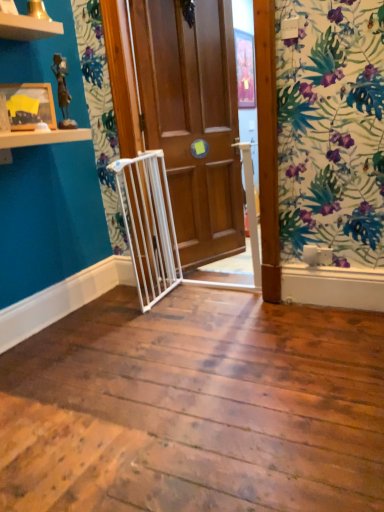
Question: Considering the positions of wooden door at center and wooden picture frame at upper left in the image, is wooden door at center taller or shorter than wooden picture frame at upper left?

Choices:
 (A) short
 (B) tall

Answer: (B)

Question: Considering their positions, is wooden door at center located in front of or behind wooden picture frame at upper left?

Choices:
 (A) behind
 (B) front

Answer: (A)

Question: Would you say wooden door at center is to the left or to the right of wooden picture frame at upper left in the picture?

Choices:
 (A) left
 (B) right

Answer: (B)

Question: From the image's perspective, is wooden picture frame at upper left located above or below wooden door at center?

Choices:
 (A) above
 (B) below

Answer: (B)

Question: Is wooden picture frame at upper left inside the boundaries of wooden door at center, or outside?

Choices:
 (A) inside
 (B) outside

Answer: (B)

Question: Is wooden picture frame at upper left to the left or to the right of wooden door at center in the image?

Choices:
 (A) right
 (B) left

Answer: (B)

Question: From a real-world perspective, relative to wooden door at center, is wooden picture frame at upper left vertically above or below?

Choices:
 (A) below
 (B) above

Answer: (B)